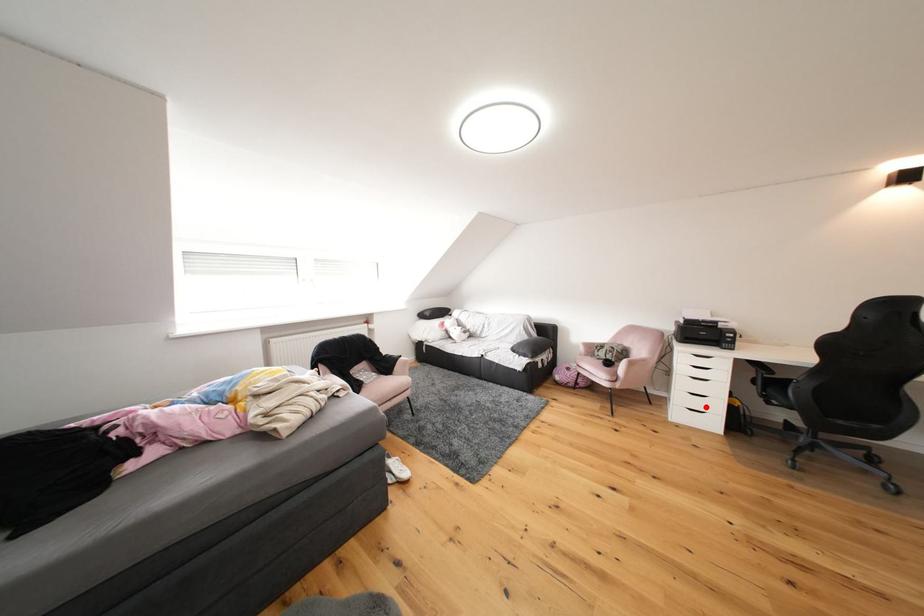
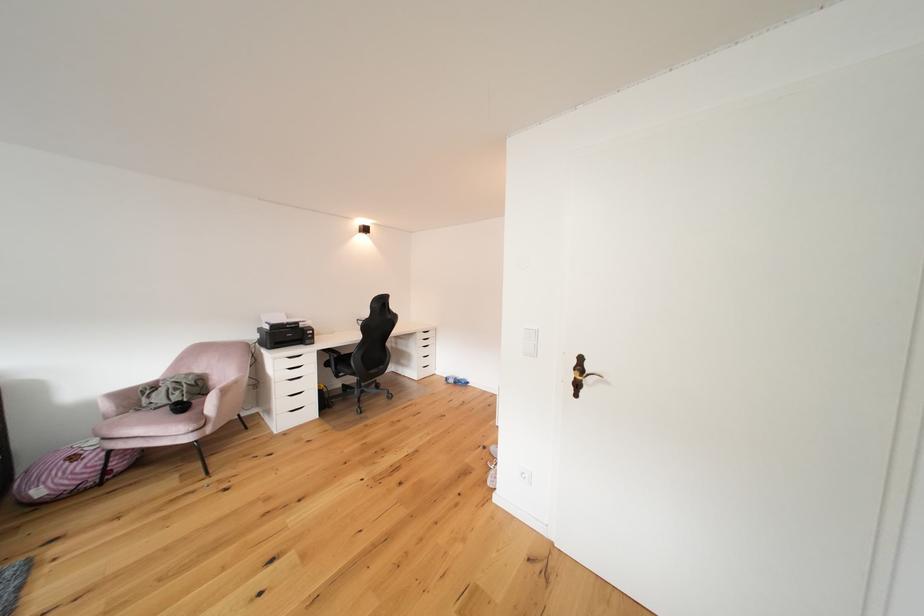
Question: I am providing you with two images of the same scene from different viewpoints. In image1, a red point is highlighted. Considering the same 3D point in image2, which of the following is correct?

Choices:
 (A) It is closer
 (B) It is farther

Answer: (A)